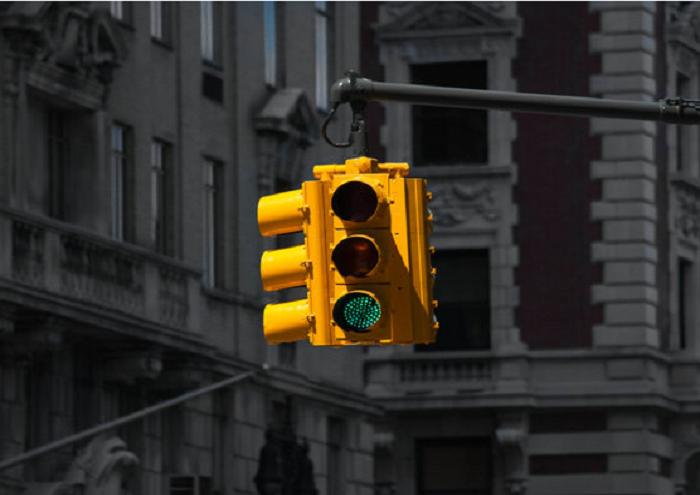
Where is `door`? The width and height of the screenshot is (700, 495). door is located at coordinates (52, 188), (454, 302).